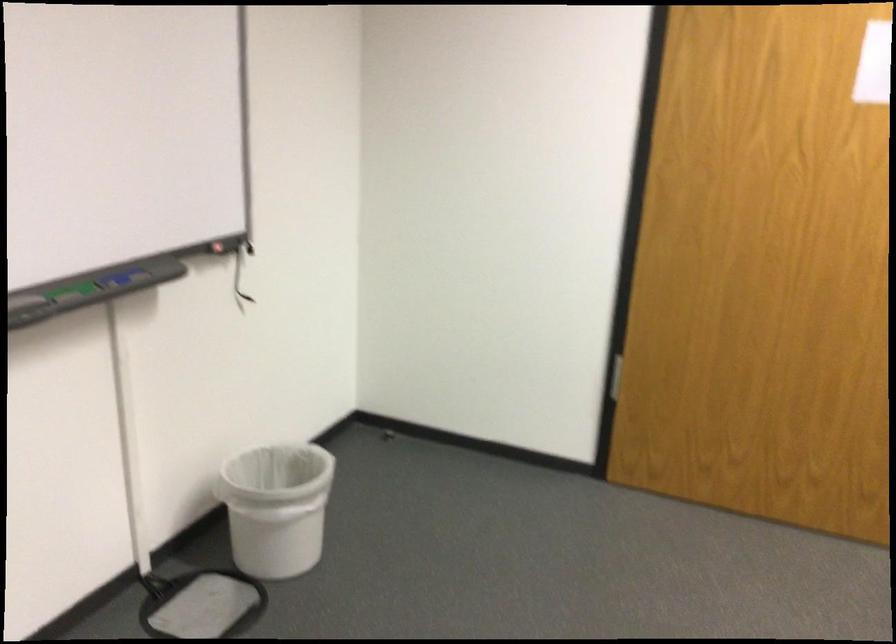
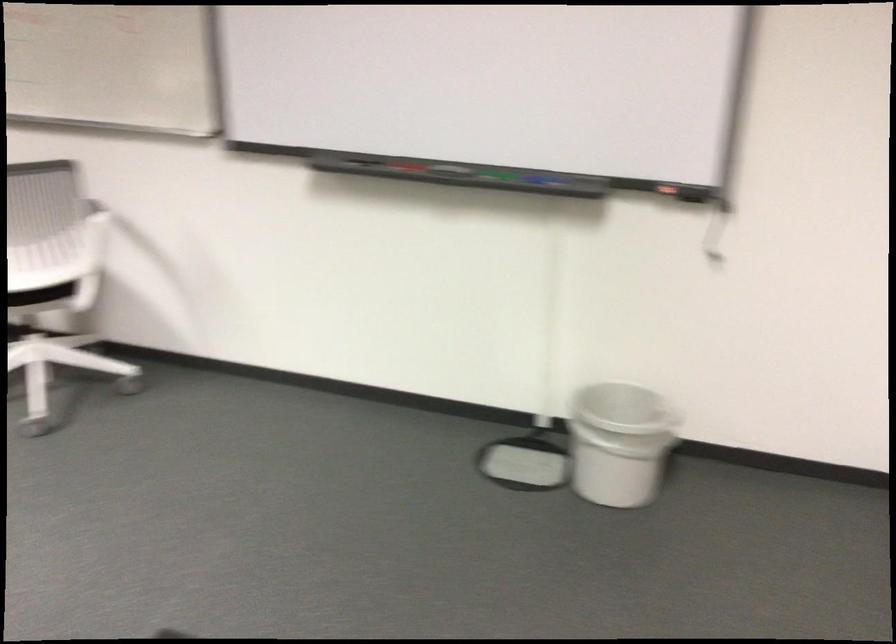
Where in the second image is the point corresponding to pixel 271 453 from the first image?

(618, 442)